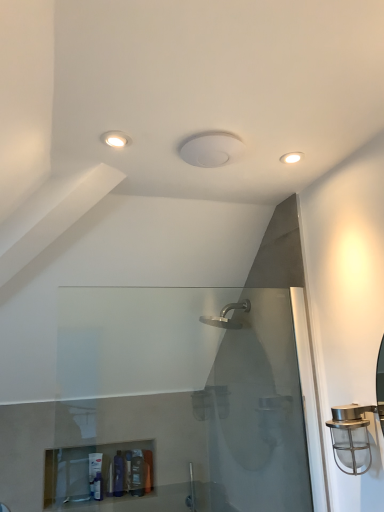
Question: Is translucent plastic bottle at lower center, the first toiletry from the right, smaller than white matte light fixture at upper right, placed as the first light fixture when sorted from right to left?

Choices:
 (A) no
 (B) yes

Answer: (A)

Question: Does translucent plastic bottle at lower center, the 3th toiletry positioned from the left, appear on the left side of white matte light fixture at upper right, which is the 1th light fixture in back-to-front order?

Choices:
 (A) no
 (B) yes

Answer: (B)

Question: From the image's perspective, would you say translucent plastic bottle at lower center, the first toiletry from the right, is shown under white matte light fixture at upper right, which is the 1th light fixture in back-to-front order?

Choices:
 (A) no
 (B) yes

Answer: (B)

Question: Does translucent plastic bottle at lower center, the 3th toiletry positioned from the left, have a larger size compared to white matte light fixture at upper right, which appears as the 2th light fixture when viewed from the left?

Choices:
 (A) no
 (B) yes

Answer: (B)

Question: Does translucent plastic bottle at lower center, the 3th toiletry positioned from the left, have a greater width compared to white matte light fixture at upper right, which appears as the 2th light fixture when viewed from the left?

Choices:
 (A) no
 (B) yes

Answer: (B)

Question: Considering the positions of metallic cage at right and translucent plastic bottle at lower left, the 1th toiletry when ordered from left to right, in the image, is metallic cage at right wider or thinner than translucent plastic bottle at lower left, the 1th toiletry when ordered from left to right,?

Choices:
 (A) thin
 (B) wide

Answer: (B)

Question: Considering their positions, is metallic cage at right located in front of or behind translucent plastic bottle at lower left, the third toiletry in the right-to-left sequence?

Choices:
 (A) behind
 (B) front

Answer: (B)

Question: Is metallic cage at right situated inside translucent plastic bottle at lower left, the third toiletry in the right-to-left sequence, or outside?

Choices:
 (A) inside
 (B) outside

Answer: (B)

Question: From a real-world perspective, relative to translucent plastic bottle at lower left, the 1th toiletry when ordered from left to right, is metallic cage at right vertically above or below?

Choices:
 (A) above
 (B) below

Answer: (A)

Question: From a real-world perspective, relative to matte white recessed light at upper left, which is the second light fixture from right to left, is translucent plastic tube at lower center, which is the 2th toiletry from right to left, vertically above or below?

Choices:
 (A) below
 (B) above

Answer: (A)

Question: From the image's perspective, is translucent plastic tube at lower center, the second toiletry positioned from the left, positioned above or below matte white recessed light at upper left, which is the 2th light fixture in back-to-front order?

Choices:
 (A) below
 (B) above

Answer: (A)

Question: Considering their positions, is translucent plastic tube at lower center, which is the 2th toiletry from right to left, located in front of or behind matte white recessed light at upper left, which ranks as the first light fixture in front-to-back order?

Choices:
 (A) behind
 (B) front

Answer: (A)

Question: Is translucent plastic tube at lower center, the second toiletry positioned from the left, to the left or to the right of matte white recessed light at upper left, which is the 2th light fixture in back-to-front order, in the image?

Choices:
 (A) left
 (B) right

Answer: (A)

Question: Is translucent plastic bottle at lower center, the 3th toiletry positioned from the left, wider or thinner than metallic cage at right?

Choices:
 (A) thin
 (B) wide

Answer: (A)

Question: From the image's perspective, is translucent plastic bottle at lower center, the 3th toiletry positioned from the left, located above or below metallic cage at right?

Choices:
 (A) above
 (B) below

Answer: (B)